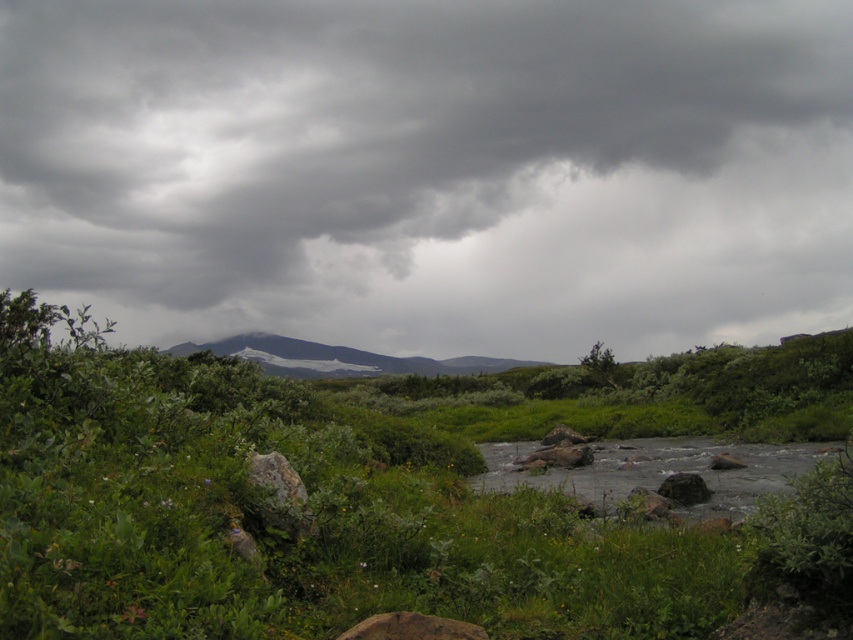
Can you confirm if smooth gray rock at lower center is taller than smooth gray rock at center?

No, smooth gray rock at lower center is not taller than smooth gray rock at center.

Is smooth gray rock at lower center smaller than smooth gray rock at center?

Indeed, smooth gray rock at lower center has a smaller size compared to smooth gray rock at center.

You are a GUI agent. You are given a task and a screenshot of the screen. Output one action in this format:
    pyautogui.click(x=<x>, y=<y>)
    Task: Click on the smooth gray rock at lower center
    This screenshot has width=853, height=640.
    Given the screenshot: What is the action you would take?
    pyautogui.click(x=412, y=627)

Find the location of `smooth gray rock at lower center`. smooth gray rock at lower center is located at coordinates (412, 627).

Who is shorter, green leafy shrubs at center or gray rock at lower right?

gray rock at lower right is shorter.

Identify the location of green leafy shrubs at center. (306, 506).

Who is lower down, snowy rock mountain at center or smooth gray rock at center?

smooth gray rock at center

Does snowy rock mountain at center lie in front of smooth gray rock at center?

That is False.

Locate an element on the screen. The height and width of the screenshot is (640, 853). snowy rock mountain at center is located at coordinates pyautogui.click(x=339, y=358).